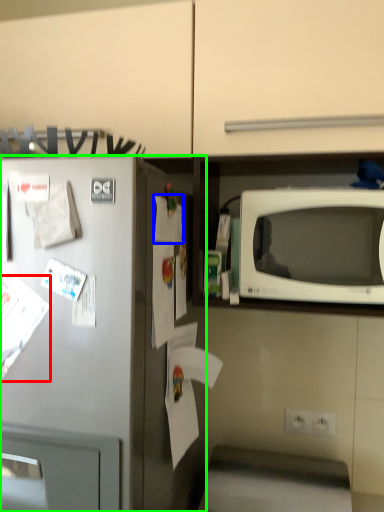
Question: Considering the real-world distances, which object is closest to paper (highlighted by a red box)? paper (highlighted by a blue box) or refrigerator (highlighted by a green box).

Choices:
 (A) paper
 (B) refrigerator

Answer: (B)